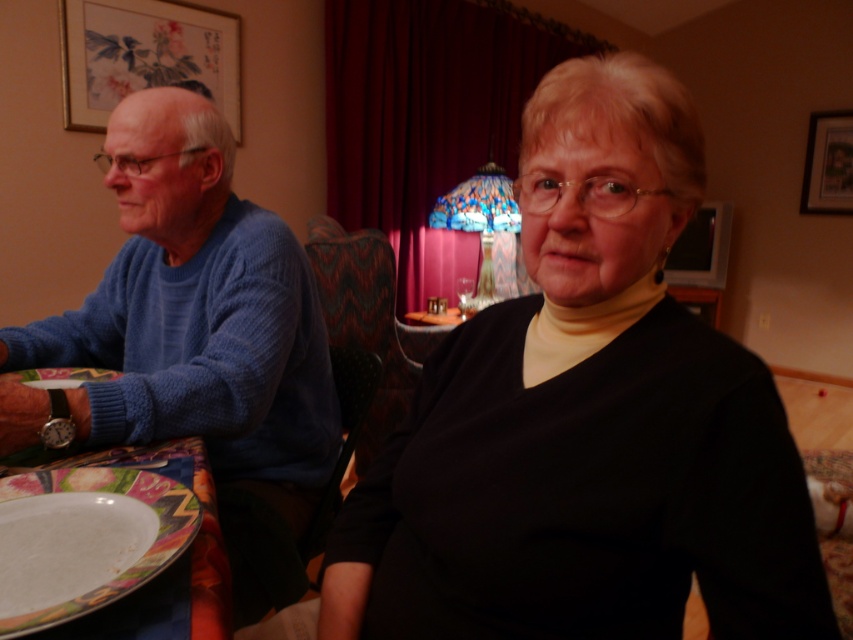
Does point (490, 456) come in front of point (212, 40)?

Yes, point (490, 456) is closer to viewer.

Based on the photo, who is positioned more to the right, black matte sweater at center or gold-framed picture at upper left?

black matte sweater at center is more to the right.

Find the location of a particular element. This screenshot has width=853, height=640. black matte sweater at center is located at coordinates (585, 420).

Is gold-framed picture at upper left behind wooden picture frame at upper right?

No, it is not.

Which of these two, gold-framed picture at upper left or wooden picture frame at upper right, stands shorter?

With less height is gold-framed picture at upper left.

This screenshot has height=640, width=853. In order to click on gold-framed picture at upper left in this screenshot , I will do (144, 54).

Is blue knitted sweater at left below white glossy plate at lower left?

No, blue knitted sweater at left is not below white glossy plate at lower left.

This screenshot has width=853, height=640. I want to click on blue knitted sweater at left, so pos(195,339).

The width and height of the screenshot is (853, 640). I want to click on blue knitted sweater at left, so click(195, 339).